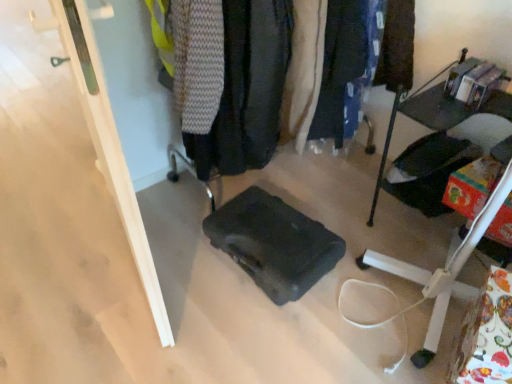
Locate an element on the screen. Image resolution: width=512 pixels, height=384 pixels. blank space above black matte suitcase at center (from a real-world perspective) is located at coordinates (275, 234).